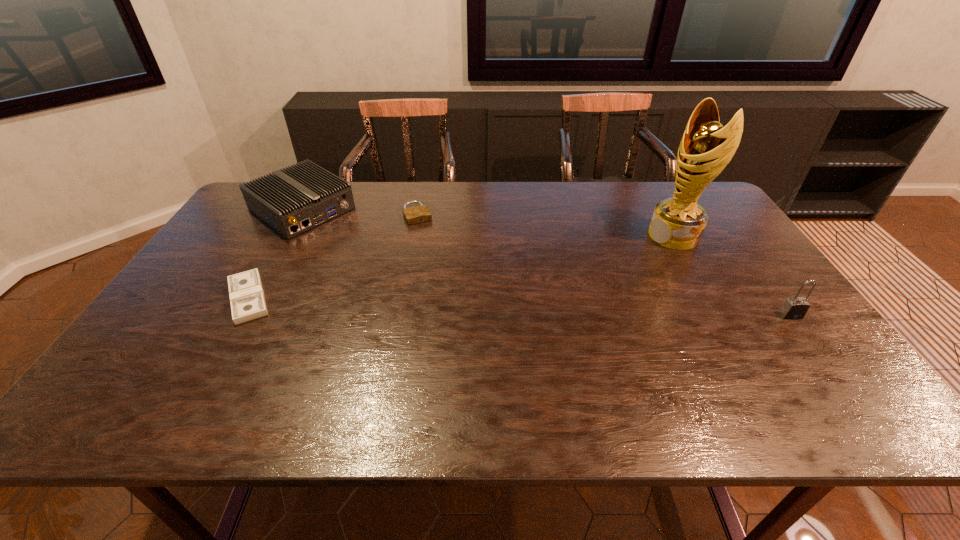
The height and width of the screenshot is (540, 960). I want to click on free space on the desktop that is between the shortest object and the taller padlock and is positioned on the back panel of the third tallest object, so click(440, 304).

Where is `vacant spot on the desktop that is between the shortest object and the nearer padlock and is positioned on the front-facing side of the award`? The height and width of the screenshot is (540, 960). vacant spot on the desktop that is between the shortest object and the nearer padlock and is positioned on the front-facing side of the award is located at coordinates (491, 306).

Find the location of a particular element. This screenshot has width=960, height=540. free spot on the desktop that is between the shortest object and the taller padlock and is positioned on the keyhole side of the farther padlock is located at coordinates (462, 305).